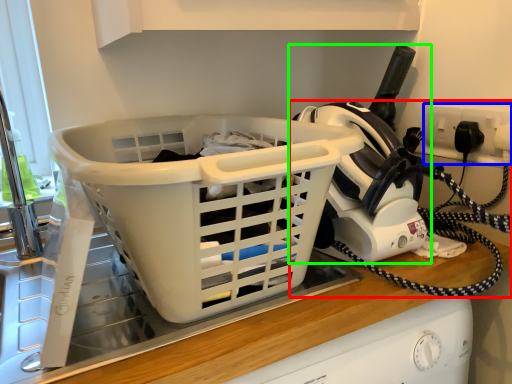
Question: Based on their relative distances, which object is nearer to home appliance (highlighted by a red box)? Choose from electric outlet (highlighted by a blue box) and appliance (highlighted by a green box).

Choices:
 (A) electric outlet
 (B) appliance

Answer: (B)